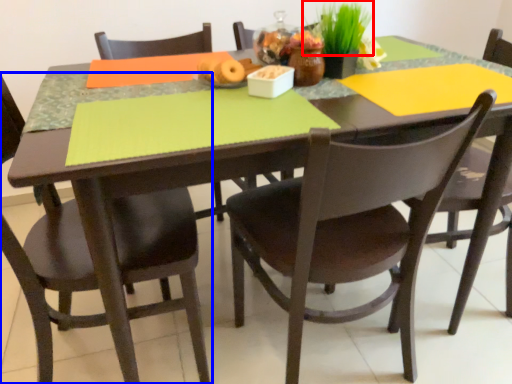
Question: Which object is closer to the camera taking this photo, plant (highlighted by a red box) or chair (highlighted by a blue box)?

Choices:
 (A) plant
 (B) chair

Answer: (B)